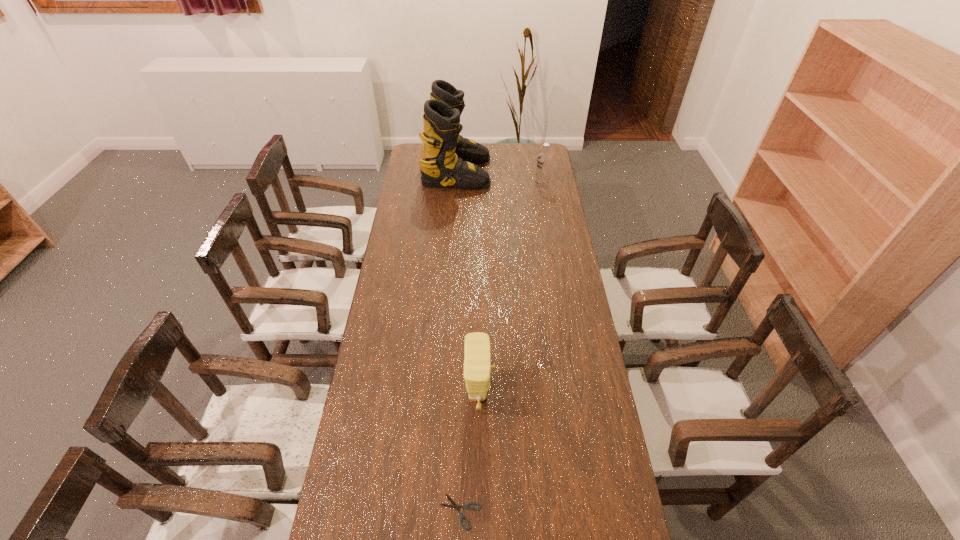
At what (x,y) coordinates should I click in order to perform the action: click on vacant area situated 0.180m on the back of the shortest object. Please return your answer as a coordinate pair (x, y). Looking at the image, I should click on (462, 430).

Locate an element on the screen. This screenshot has width=960, height=540. object located at the far edge is located at coordinates (447, 159).

This screenshot has height=540, width=960. Find the location of `object located in the left edge section of the desktop`. object located in the left edge section of the desktop is located at coordinates (447, 159).

The image size is (960, 540). Identify the location of object that is at the right edge. (544, 161).

Locate an element on the screen. object that is at the far left corner is located at coordinates (447, 159).

The width and height of the screenshot is (960, 540). In order to click on vacant space at the left edge of the desktop in this screenshot , I will do `click(396, 236)`.

The height and width of the screenshot is (540, 960). Identify the location of vacant area at the right edge of the desktop. (595, 387).

At what (x,y) coordinates should I click in order to perform the action: click on empty space that is in between the rightmost object and the nearest object. Please return your answer as a coordinate pair (x, y). This screenshot has width=960, height=540. Looking at the image, I should click on (501, 348).

At what (x,y) coordinates should I click in order to perform the action: click on free point between the rightmost object and the nearest object. Please return your answer as a coordinate pair (x, y). This screenshot has height=540, width=960. Looking at the image, I should click on (501, 348).

Identify the location of free space that is in between the sponge and the vodka. The height and width of the screenshot is (540, 960). (511, 289).